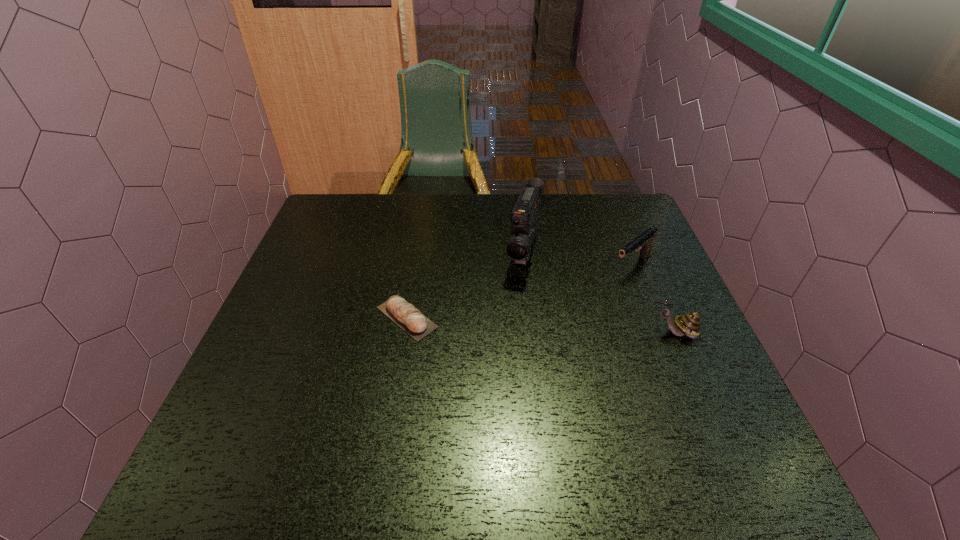
What are the coordinates of `blank space located 0.170m at the muzzle of the pistol` in the screenshot? It's located at (580, 307).

This screenshot has height=540, width=960. I want to click on vacant region located at the muzzle of the pistol, so click(572, 313).

You are a GUI agent. You are given a task and a screenshot of the screen. Output one action in this format:
    pyautogui.click(x=<x>, y=<y>)
    Task: Click on the vacant area situated at the muzzle of the pistol
    
    Given the screenshot: What is the action you would take?
    pyautogui.click(x=542, y=336)

Find the location of a particular element. The image size is (960, 540). free space located on the front-facing side of the tallest object is located at coordinates (514, 326).

Locate an element on the screen. Image resolution: width=960 pixels, height=540 pixels. blank space located 0.130m on the front-facing side of the tallest object is located at coordinates (515, 320).

The height and width of the screenshot is (540, 960). In order to click on vacant space located on the front-facing side of the tallest object in this screenshot , I will do `click(503, 373)`.

At what (x,y) coordinates should I click in order to perform the action: click on object situated at the far edge. Please return your answer as a coordinate pair (x, y). Looking at the image, I should click on (524, 218).

Find the location of a particular element. snail present at the right edge is located at coordinates (689, 324).

Find the location of a particular element. The image size is (960, 540). pistol situated at the right edge is located at coordinates (644, 241).

Find the location of a particular element. This screenshot has width=960, height=540. free space at the far edge is located at coordinates (428, 218).